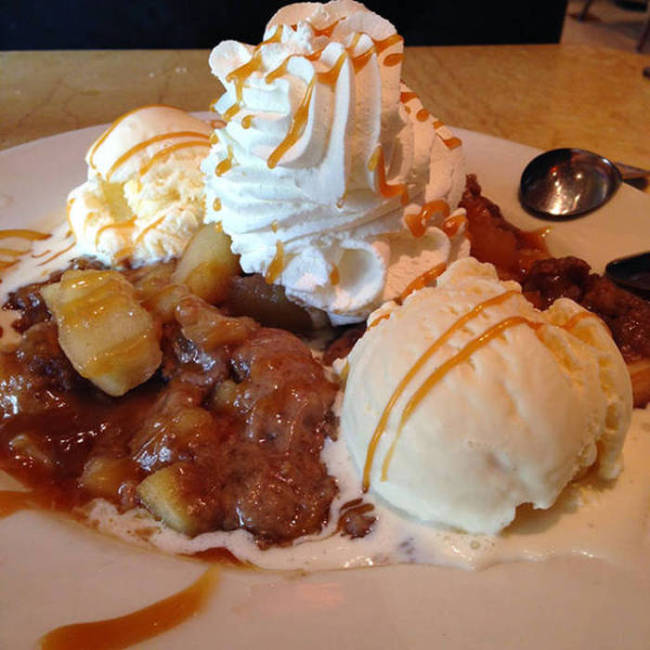
Where is `plate`? The width and height of the screenshot is (650, 650). plate is located at coordinates (80, 574).